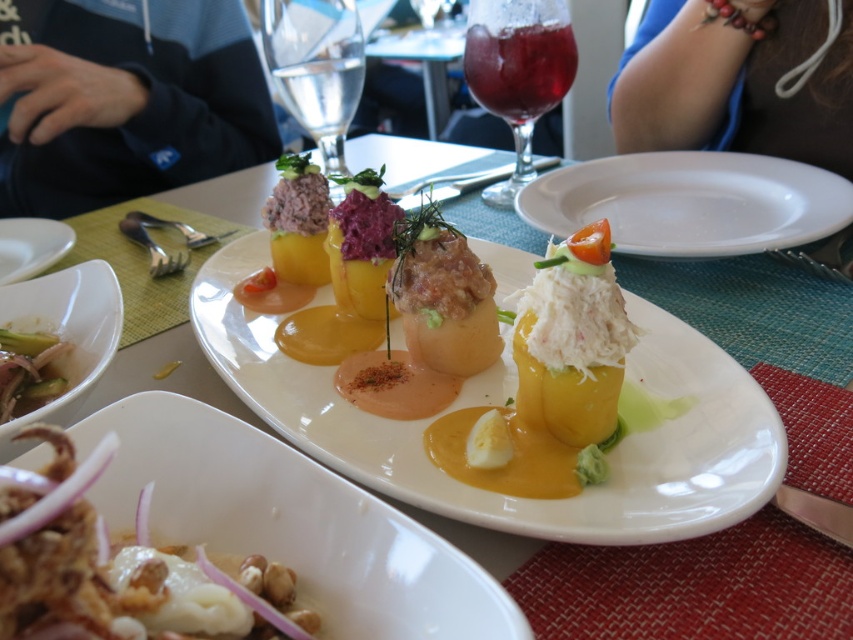
Question: Which of the following is the farthest from the observer?

Choices:
 (A) white ceramic plate at center
 (B) blue fabric at upper right

Answer: (B)

Question: Which object appears closest to the camera in this image?

Choices:
 (A) shiny silver fork at lower left
 (B) blue fabric at upper right

Answer: (A)

Question: Considering the relative positions of black fleece at upper left and white creamy sauce at center in the image provided, where is black fleece at upper left located with respect to white creamy sauce at center?

Choices:
 (A) above
 (B) below

Answer: (A)

Question: In this image, where is white creamy sauce at center located relative to white glossy plate at upper left?

Choices:
 (A) right
 (B) left

Answer: (A)

Question: Which is farther from the white creamy sauce at center?

Choices:
 (A) white glossy bowl at lower left
 (B) yellow matte/painted fruit at center
 (C) transparent glass at upper center
 (D) black fleece at upper left

Answer: (D)

Question: Can you confirm if black fleece at upper left is smaller than white creamy sauce at center?

Choices:
 (A) no
 (B) yes

Answer: (A)